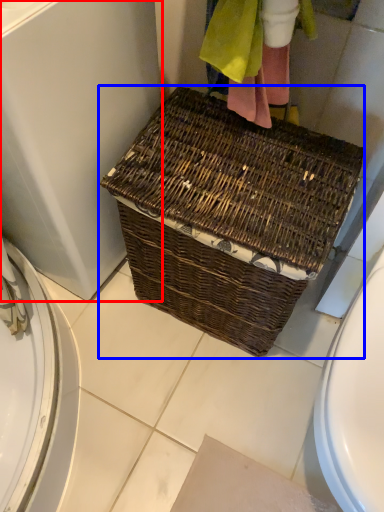
Question: Which point is further to the camera, screen door (highlighted by a red box) or picnic basket (highlighted by a blue box)?

Choices:
 (A) screen door
 (B) picnic basket

Answer: (B)